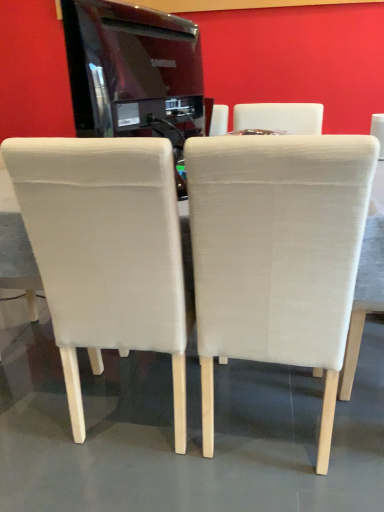
Image resolution: width=384 pixels, height=512 pixels. What are the coordinates of `beige fabric chair at right, the third chair from the left` in the screenshot? It's located at (378, 131).

Describe the element at coordinates (378, 131) in the screenshot. I see `beige fabric chair at right, acting as the 1th chair starting from the right` at that location.

I want to click on glossy black tv at upper center, so click(x=133, y=71).

From a real-world perspective, between beige fabric chair at center, which is the first chair from left to right, and beige fabric chair at right, acting as the 1th chair starting from the right, who is vertically higher?

beige fabric chair at right, acting as the 1th chair starting from the right, from a real-world perspective.

Consider the image. Does beige fabric chair at center, which is the first chair from left to right, have a lesser width compared to beige fabric chair at right, the third chair from the left?

Incorrect, the width of beige fabric chair at center, which is the first chair from left to right, is not less than that of beige fabric chair at right, the third chair from the left.

Which is correct: beige fabric chair at center, the 3th chair in the right-to-left sequence, is inside beige fabric chair at right, the third chair from the left, or outside of it?

beige fabric chair at center, the 3th chair in the right-to-left sequence, lies outside beige fabric chair at right, the third chair from the left.

Which is nearer, (377, 127) or (94, 106)?

The point (377, 127) is more forward.

Is beige fabric chair at right, acting as the 1th chair starting from the right, oriented towards glossy black tv at upper center?

No, beige fabric chair at right, acting as the 1th chair starting from the right, is not turned towards glossy black tv at upper center.

Is beige fabric chair at right, the third chair from the left, at the right side of glossy black tv at upper center?

Indeed, beige fabric chair at right, the third chair from the left, is positioned on the right side of glossy black tv at upper center.

Is white fabric table at center positioned with its back to beige fabric chair at center, which is the first chair from left to right?

That's not correct — white fabric table at center is not looking away from beige fabric chair at center, which is the first chair from left to right.

Can you tell me how much white fabric table at center and beige fabric chair at center, the 3th chair in the right-to-left sequence, differ in facing direction?

white fabric table at center and beige fabric chair at center, the 3th chair in the right-to-left sequence, are facing 90 degrees away from each other.

Is white fabric table at center situated inside beige fabric chair at center, the 3th chair in the right-to-left sequence, or outside?

The correct answer is: outside.

Does point (39, 286) appear closer or farther from the camera than point (126, 336)?

Point (39, 286) appears to be farther away from the viewer than point (126, 336).

Identify the location of chair located below the beige fabric chair at center, the 3th chair in the right-to-left sequence (from the image's perspective). This screenshot has width=384, height=512. click(277, 254).

Is beige fabric chair at center, the 3th chair in the right-to-left sequence, oriented towards beige fabric chair at center, positioned as the second chair in right-to-left order?

No, beige fabric chair at center, the 3th chair in the right-to-left sequence, is not turned towards beige fabric chair at center, positioned as the second chair in right-to-left order.

Are beige fabric chair at center, the 3th chair in the right-to-left sequence, and beige fabric chair at center, positioned as the second chair in right-to-left order, making contact?

beige fabric chair at center, the 3th chair in the right-to-left sequence, and beige fabric chair at center, positioned as the second chair in right-to-left order, are clearly separated.

From a real-world perspective, which is physically below, beige fabric chair at center, which is the first chair from left to right, or beige fabric chair at center, positioned as the second chair in right-to-left order?

beige fabric chair at center, positioned as the second chair in right-to-left order, from a real-world perspective.

Which is more to the right, beige fabric chair at right, acting as the 1th chair starting from the right, or beige fabric chair at center, the 3th chair in the right-to-left sequence?

Positioned to the right is beige fabric chair at right, acting as the 1th chair starting from the right.

Does point (376, 132) come in front of point (182, 303)?

No, (376, 132) is behind (182, 303).

From the image's perspective, which is below, beige fabric chair at right, the third chair from the left, or beige fabric chair at center, which is the first chair from left to right?

beige fabric chair at center, which is the first chair from left to right, appears lower in the image.

From a real-world perspective, is beige fabric chair at right, the third chair from the left, above or below beige fabric chair at center, the 3th chair in the right-to-left sequence?

In terms of real-world spatial position, beige fabric chair at right, the third chair from the left, is above beige fabric chair at center, the 3th chair in the right-to-left sequence.

From the picture: Is beige fabric chair at right, the third chair from the left, positioned before beige fabric chair at center, which ranks as the 2th chair in left-to-right order?

No, beige fabric chair at right, the third chair from the left, is behind beige fabric chair at center, which ranks as the 2th chair in left-to-right order.

Is beige fabric chair at right, acting as the 1th chair starting from the right, with beige fabric chair at center, positioned as the second chair in right-to-left order?

No, beige fabric chair at right, acting as the 1th chair starting from the right, is not with beige fabric chair at center, positioned as the second chair in right-to-left order.

From the image's perspective, which chair is the 2nd one below the beige fabric chair at right, the third chair from the left? Please provide its 2D coordinates.

[(277, 254)]

Measure the distance between beige fabric chair at center, the 3th chair in the right-to-left sequence, and white fabric table at center.

The distance of beige fabric chair at center, the 3th chair in the right-to-left sequence, from white fabric table at center is 26.07 inches.

Does beige fabric chair at center, the 3th chair in the right-to-left sequence, turn towards white fabric table at center?

Yes.

Is beige fabric chair at center, the 3th chair in the right-to-left sequence, completely or partially outside of white fabric table at center?

Actually, beige fabric chair at center, the 3th chair in the right-to-left sequence, is at least partially inside white fabric table at center.

From the image's perspective, would you say beige fabric chair at center, the 3th chair in the right-to-left sequence, is positioned over white fabric table at center?

No, from the image's perspective, beige fabric chair at center, the 3th chair in the right-to-left sequence, is not on top of white fabric table at center.

From the image's perspective, which chair is the 1st one below the beige fabric chair at right, the third chair from the left? Please provide its 2D coordinates.

[(106, 252)]

From the glossy black tv at upper center, count 2nd chairs backward and point to it. Please provide its 2D coordinates.

[(378, 131)]

Based on their spatial positions, is beige fabric chair at center, positioned as the second chair in right-to-left order, or beige fabric chair at right, acting as the 1th chair starting from the right, closer to glossy black tv at upper center?

beige fabric chair at center, positioned as the second chair in right-to-left order, is closer to glossy black tv at upper center.

When comparing their distances from beige fabric chair at center, positioned as the second chair in right-to-left order, does glossy black tv at upper center or beige fabric chair at right, acting as the 1th chair starting from the right, seem further?

glossy black tv at upper center lies further to beige fabric chair at center, positioned as the second chair in right-to-left order, than the other object.

When comparing their distances from beige fabric chair at right, acting as the 1th chair starting from the right, does white fabric table at center or glossy black tv at upper center seem further?

Based on the image, glossy black tv at upper center appears to be further to beige fabric chair at right, acting as the 1th chair starting from the right.

When comparing their distances from beige fabric chair at center, the 3th chair in the right-to-left sequence, does white fabric table at center or beige fabric chair at center, which ranks as the 2th chair in left-to-right order, seem closer?

Based on the image, beige fabric chair at center, which ranks as the 2th chair in left-to-right order, appears to be nearer to beige fabric chair at center, the 3th chair in the right-to-left sequence.

When comparing their distances from beige fabric chair at center, which is the first chair from left to right, does beige fabric chair at center, which ranks as the 2th chair in left-to-right order, or white fabric table at center seem closer?

Based on the image, beige fabric chair at center, which ranks as the 2th chair in left-to-right order, appears to be nearer to beige fabric chair at center, which is the first chair from left to right.

From the image, which object appears to be nearer to glossy black tv at upper center, white fabric table at center or beige fabric chair at right, acting as the 1th chair starting from the right?

beige fabric chair at right, acting as the 1th chair starting from the right, is positioned closer to the anchor glossy black tv at upper center.

When comparing their distances from beige fabric chair at center, positioned as the second chair in right-to-left order, does white fabric table at center or beige fabric chair at right, the third chair from the left, seem closer?

white fabric table at center is positioned closer to the anchor beige fabric chair at center, positioned as the second chair in right-to-left order.

Looking at this image, which object lies further to the anchor point beige fabric chair at right, the third chair from the left, white fabric table at center or beige fabric chair at center, positioned as the second chair in right-to-left order?

beige fabric chair at center, positioned as the second chair in right-to-left order, lies further to beige fabric chair at right, the third chair from the left, than the other object.

Image resolution: width=384 pixels, height=512 pixels. Find the location of `table between glossy black tv at upper center and beige fabric chair at right, acting as the 1th chair starting from the right, in the horizontal direction`. table between glossy black tv at upper center and beige fabric chair at right, acting as the 1th chair starting from the right, in the horizontal direction is located at coordinates (366, 282).

Image resolution: width=384 pixels, height=512 pixels. Identify the location of appliance between beige fabric chair at center, which is the first chair from left to right, and beige fabric chair at right, the third chair from the left, in the horizontal direction. (133, 71).

Find the location of a particular element. Image resolution: width=384 pixels, height=512 pixels. table positioned between beige fabric chair at center, positioned as the second chair in right-to-left order, and beige fabric chair at right, the third chair from the left, from near to far is located at coordinates (366, 282).

Identify the location of table between glossy black tv at upper center and beige fabric chair at center, positioned as the second chair in right-to-left order, vertically. (366, 282).